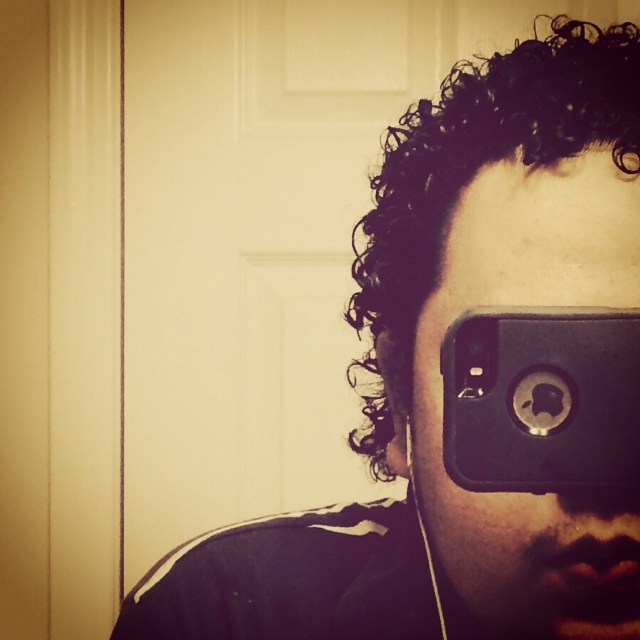
Question: Can you confirm if black matte phone at center is positioned to the right of black rubberized phone at center?

Choices:
 (A) yes
 (B) no

Answer: (B)

Question: Among these points, which one is farthest from the camera?

Choices:
 (A) (532, 340)
 (B) (490, 604)

Answer: (B)

Question: Does black matte phone at center have a greater width compared to black rubberized phone at center?

Choices:
 (A) yes
 (B) no

Answer: (A)

Question: Which point is farther to the camera?

Choices:
 (A) (426, 349)
 (B) (602, 461)

Answer: (A)

Question: Does black matte phone at center appear on the left side of black rubberized phone at center?

Choices:
 (A) yes
 (B) no

Answer: (A)